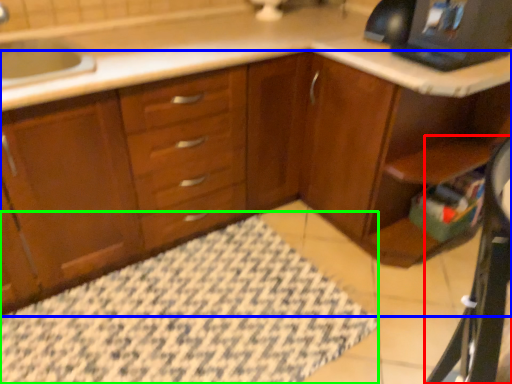
Question: Which object is the closest to the computer desk (highlighted by a red box)? Choose among these: cabinetry (highlighted by a blue box) or bath mat (highlighted by a green box).

Choices:
 (A) cabinetry
 (B) bath mat

Answer: (B)